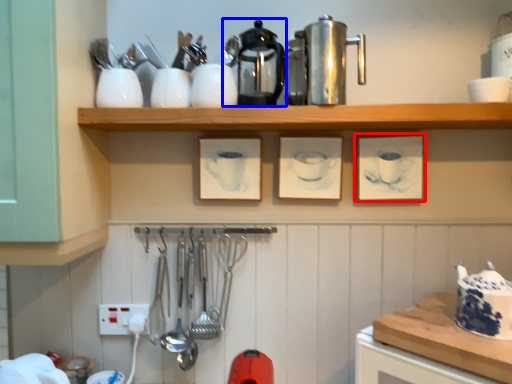
Question: Which object is closer to the camera taking this photo, picture frame (highlighted by a red box) or coffeepot (highlighted by a blue box)?

Choices:
 (A) picture frame
 (B) coffeepot

Answer: (B)